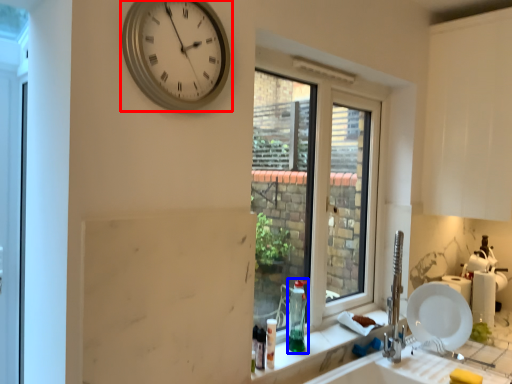
Question: Which of the following is the closest to the observer, wall clock (highlighted by a red box) or bottle (highlighted by a blue box)?

Choices:
 (A) wall clock
 (B) bottle

Answer: (A)